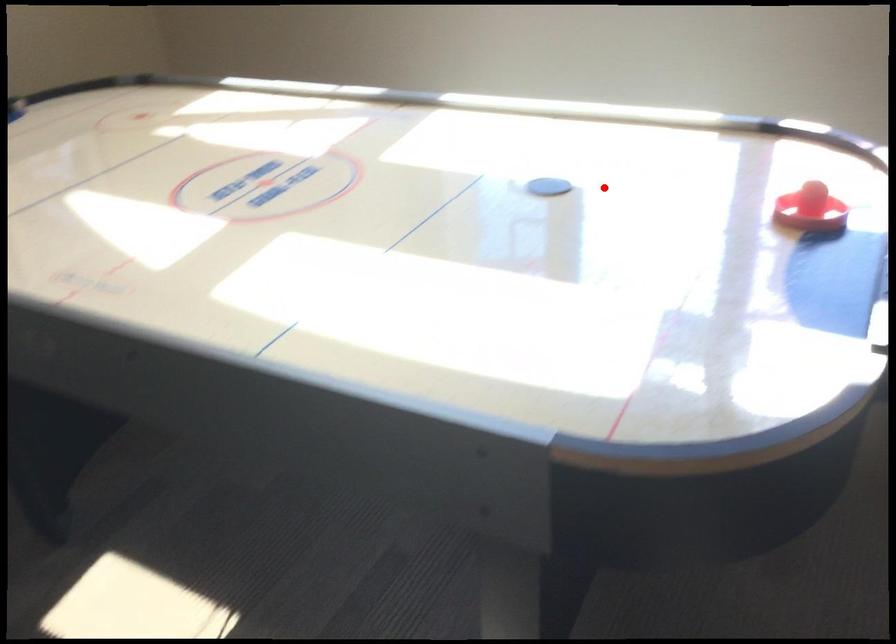
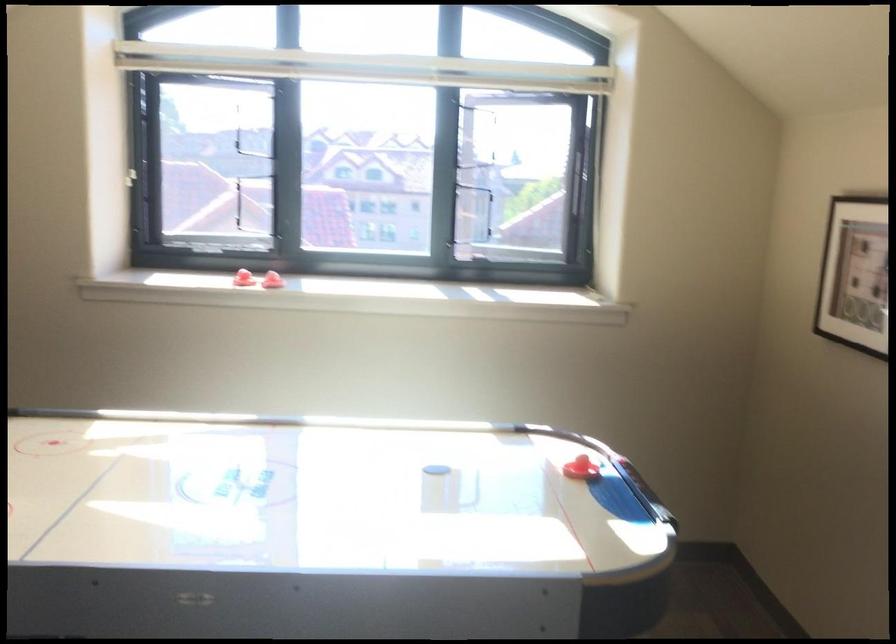
Find the pixel in the second image that matches the highlighted location in the first image.

(442, 467)